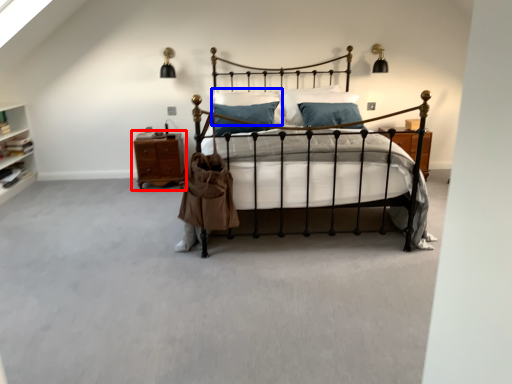
Question: Among these objects, which one is nearest to the camera, nightstand (highlighted by a red box) or pillow (highlighted by a blue box)?

Choices:
 (A) nightstand
 (B) pillow

Answer: (B)